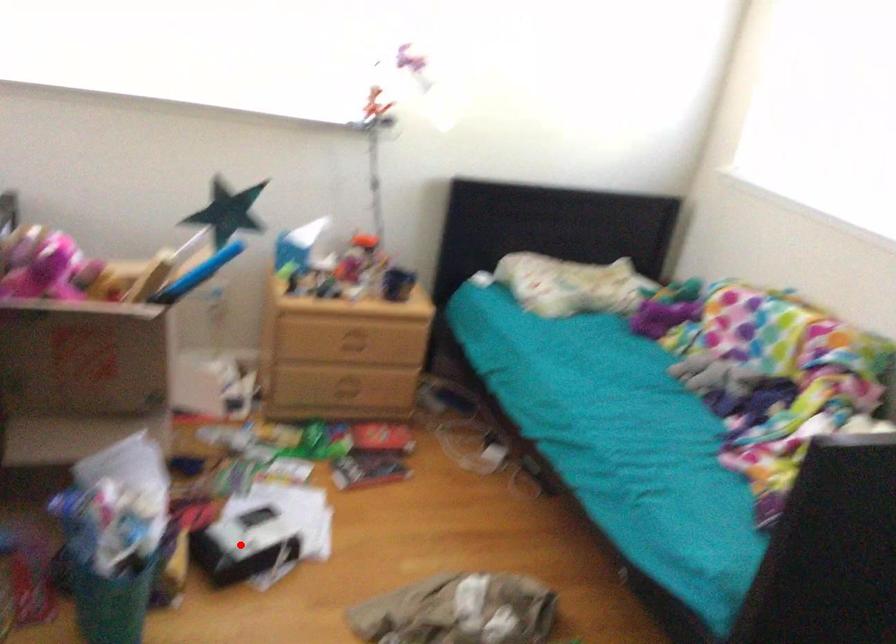
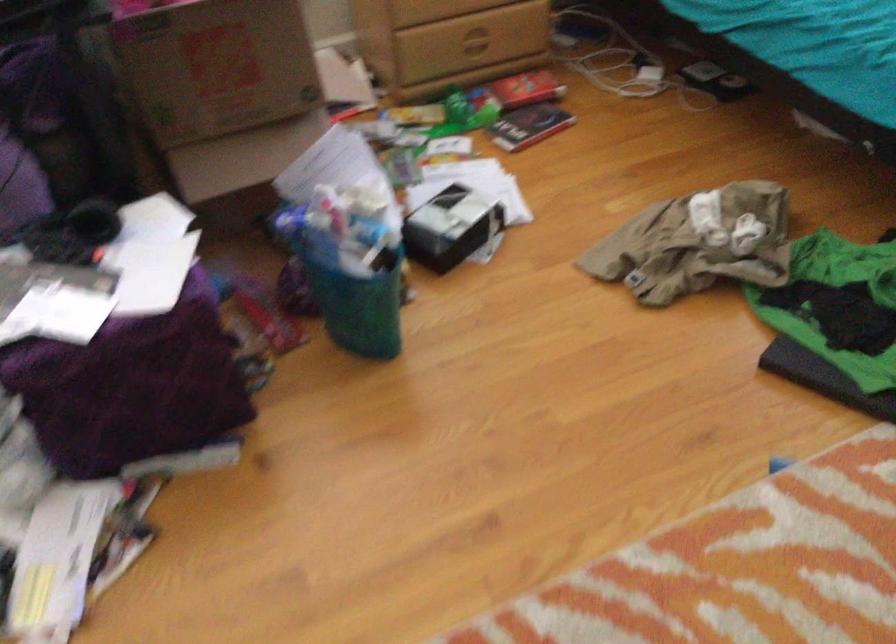
Where in the second image is the point corresponding to the highlighted location from the first image?

(451, 227)